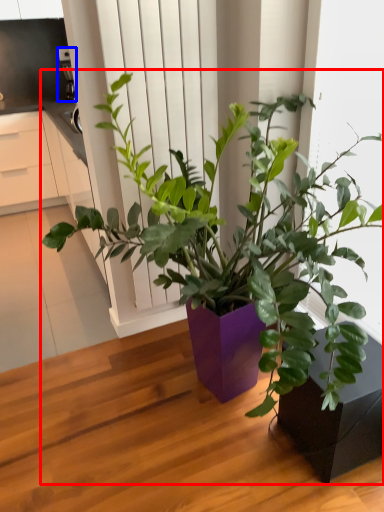
Question: Which object is further to the camera taking this photo, houseplant (highlighted by a red box) or appliance (highlighted by a blue box)?

Choices:
 (A) houseplant
 (B) appliance

Answer: (B)